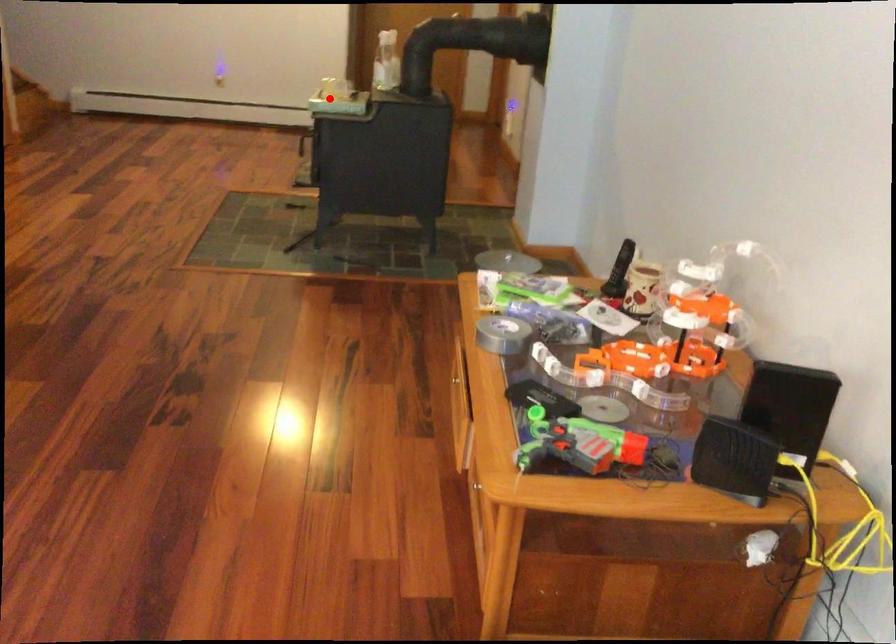
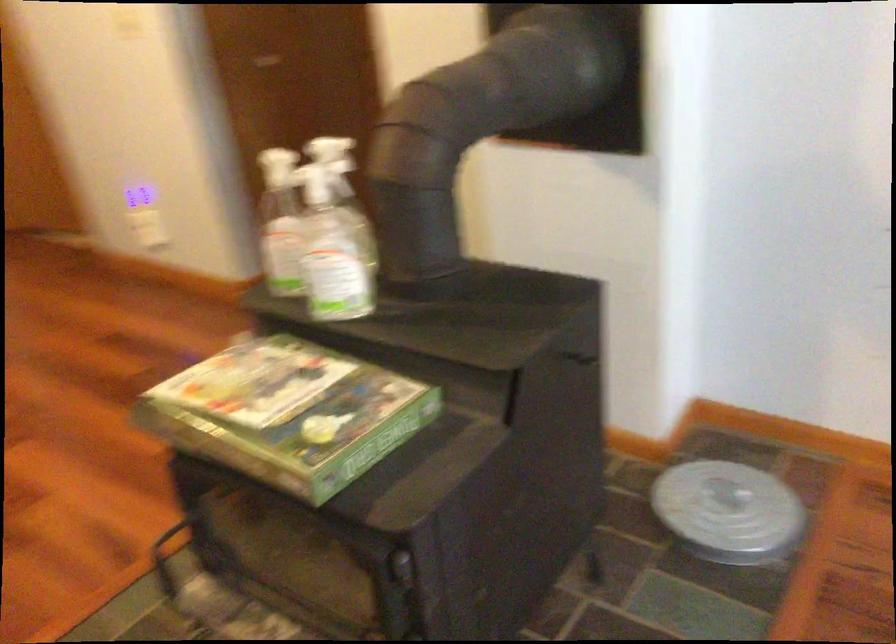
The point at the highlighted location is marked in the first image. Where is the corresponding point in the second image?

(289, 413)